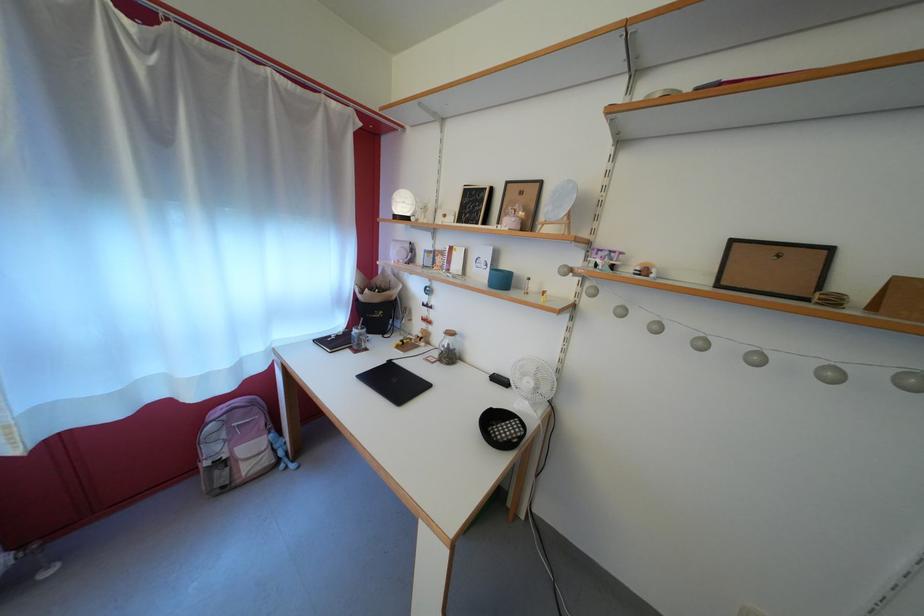
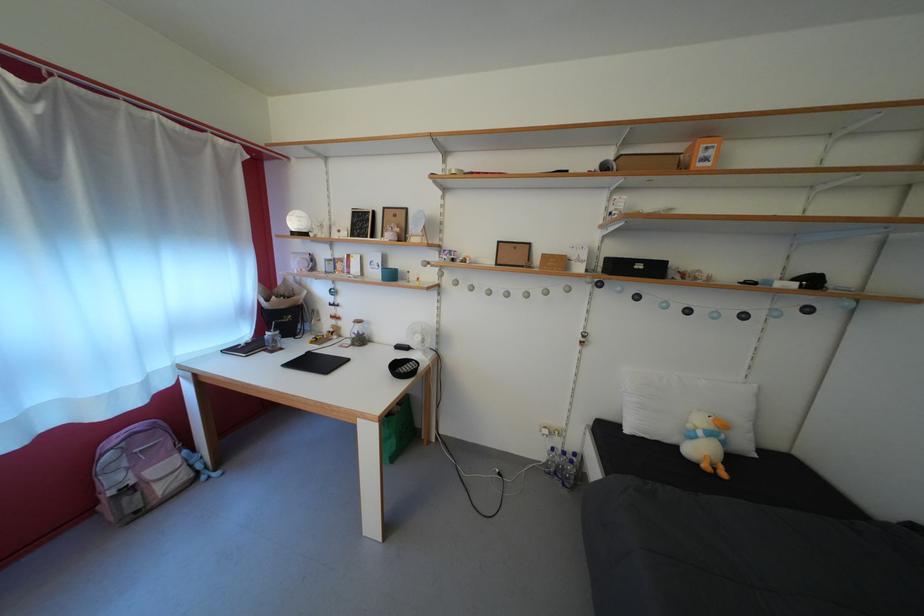
The point at (398, 368) is marked in the first image. Where is the corresponding point in the second image?

(317, 360)